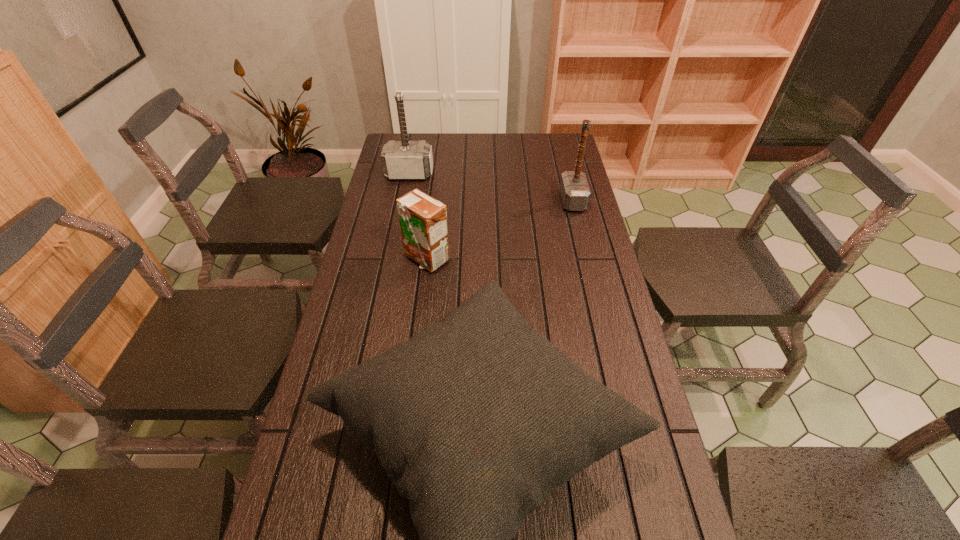
Identify the location of vacant area between the shortest object and the nearer hammer. (499, 230).

In order to click on free space that is in between the third nearest object and the carton in this screenshot , I will do `click(499, 230)`.

The image size is (960, 540). In order to click on empty location between the carton and the right hammer in this screenshot , I will do `click(499, 230)`.

Identify which object is located as the third nearest to the nearest object. Please provide its 2D coordinates. Your answer should be formatted as a tuple, i.e. [(x, y)], where the tuple contains the x and y coordinates of a point satisfying the conditions above.

[(402, 160)]

You are a GUI agent. You are given a task and a screenshot of the screen. Output one action in this format:
    pyautogui.click(x=<x>, y=<y>)
    Task: Click on the object identified as the closest to the third farthest object
    
    Given the screenshot: What is the action you would take?
    pyautogui.click(x=476, y=419)

Find the location of a particular element. The image size is (960, 540). free location that satisfies the following two spatial constraints: 1. on the striking surface of the right hammer; 2. on the straw side of the shortest object is located at coordinates (587, 258).

This screenshot has height=540, width=960. I want to click on vacant position in the image that satisfies the following two spatial constraints: 1. on the striking surface of the second farthest object; 2. on the straw side of the second nearest object, so click(x=587, y=258).